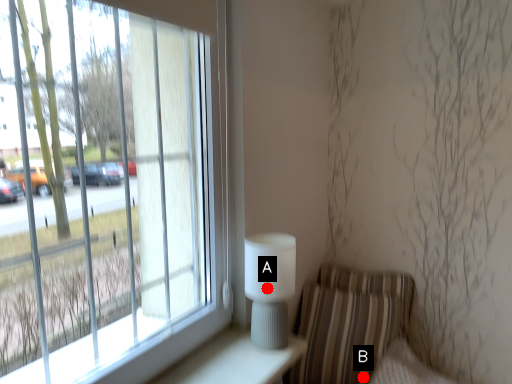
Question: Two points are circled on the image, labeled by A and B beside each circle. Which point appears closest to the camera in this image?

Choices:
 (A) A is closer
 (B) B is closer

Answer: (A)